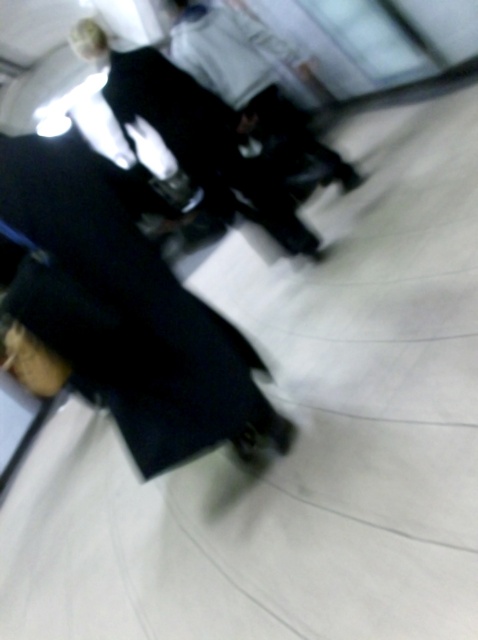
Question: Which point is closer to the camera?

Choices:
 (A) (188, 323)
 (B) (90, 29)
 (C) (228, 13)

Answer: (A)

Question: Is black fabric business suit at lower left smaller than dark fabric jacket at center?

Choices:
 (A) no
 (B) yes

Answer: (A)

Question: Estimate the real-world distances between objects in this image. Which object is closer to the black leather jacket at upper center?

Choices:
 (A) dark fabric jacket at center
 (B) black fabric business suit at lower left

Answer: (A)

Question: Estimate the real-world distances between objects in this image. Which object is closer to the black fabric business suit at lower left?

Choices:
 (A) black leather jacket at upper center
 (B) dark fabric jacket at center

Answer: (A)

Question: Can you confirm if black fabric business suit at lower left is bigger than dark fabric jacket at center?

Choices:
 (A) no
 (B) yes

Answer: (B)

Question: Does black fabric business suit at lower left have a greater width compared to dark fabric jacket at center?

Choices:
 (A) no
 (B) yes

Answer: (A)